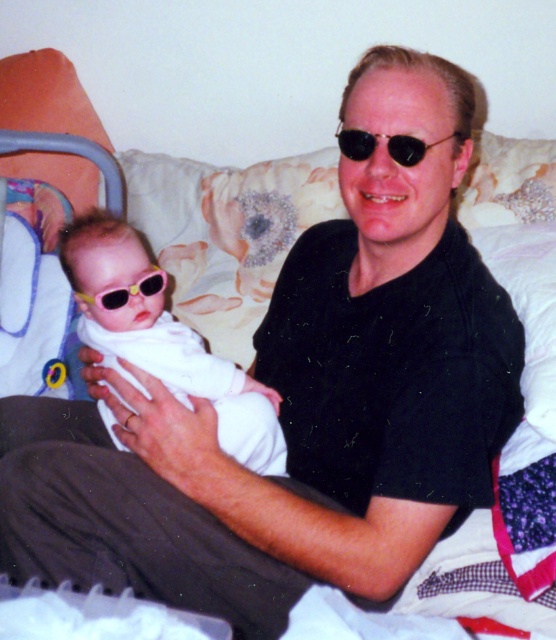
Question: Is black matte sunglasses at upper center positioned at the back of yellow plastic goggles at center?

Choices:
 (A) no
 (B) yes

Answer: (A)

Question: Which point is closer to the camera?

Choices:
 (A) yellow plastic goggles at center
 (B) black matte sunglasses at upper center
 (C) white soft baby at center

Answer: (B)

Question: Is black matte sunglasses at upper center further to camera compared to yellow plastic goggles at center?

Choices:
 (A) no
 (B) yes

Answer: (A)

Question: Which object is positioned closest to the yellow plastic goggles at center?

Choices:
 (A) white soft baby at center
 (B) black matte sunglasses at upper center

Answer: (A)

Question: Which object appears closest to the camera in this image?

Choices:
 (A) white soft baby at center
 (B) black matte sunglasses at upper center
 (C) yellow plastic goggles at center

Answer: (B)

Question: Can you confirm if white soft baby at center is smaller than yellow plastic goggles at center?

Choices:
 (A) yes
 (B) no

Answer: (B)